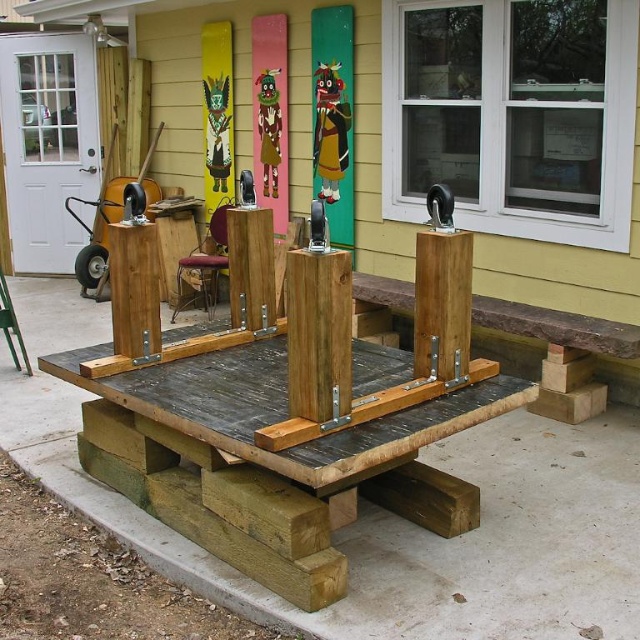
From the picture: You are standing at the front of the wooden workbench and want to place a tool on the brown wooden post at center. However, there is a velvet red stool at center in the way. To reach the post, should you move the stool forward or backward?

The brown wooden post at center is in front of the velvet red stool at center, so you should move the velvet red stool at center backward to access the brown wooden post at center.

From the picture: You are a painter standing at the weathered wood bench at center and want to reach the velvet red stool at center to pick up a paintbrush. Can you do this without moving more than 3 meters?

The weathered wood bench at center is 3.12 meters away from velvet red stool at center. Since the distance is slightly more than 3 meters, you cannot reach the velvet red stool at center without moving more than 3 meters.